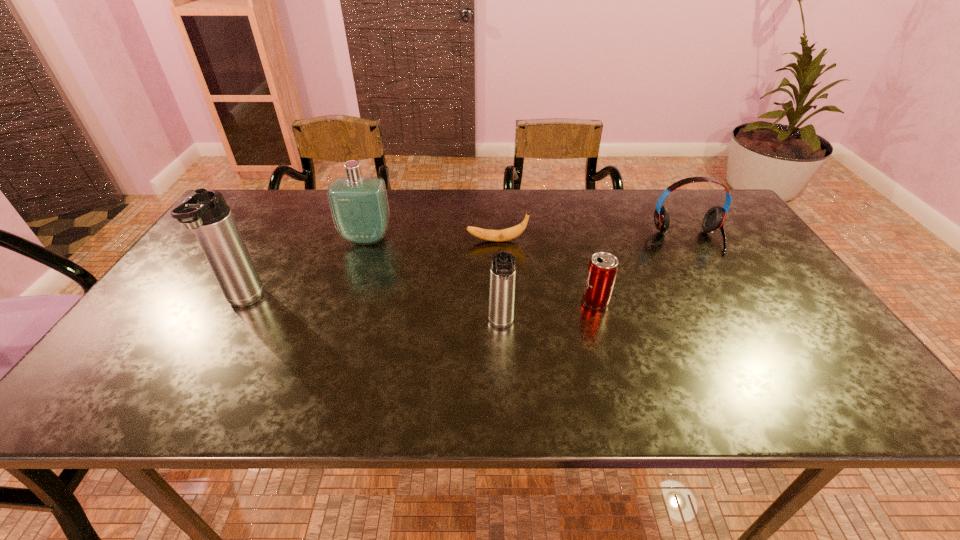
Find the location of a particular element. This screenshot has height=540, width=960. vacant space that satisfies the following two spatial constraints: 1. on the peel of the banana from the top; 2. on the handle side of the taller thermos bottle is located at coordinates (499, 302).

Identify the location of vacant area in the image that satisfies the following two spatial constraints: 1. on the peel of the beer can from the top; 2. on the right side of the shortest object. The width and height of the screenshot is (960, 540). (499, 301).